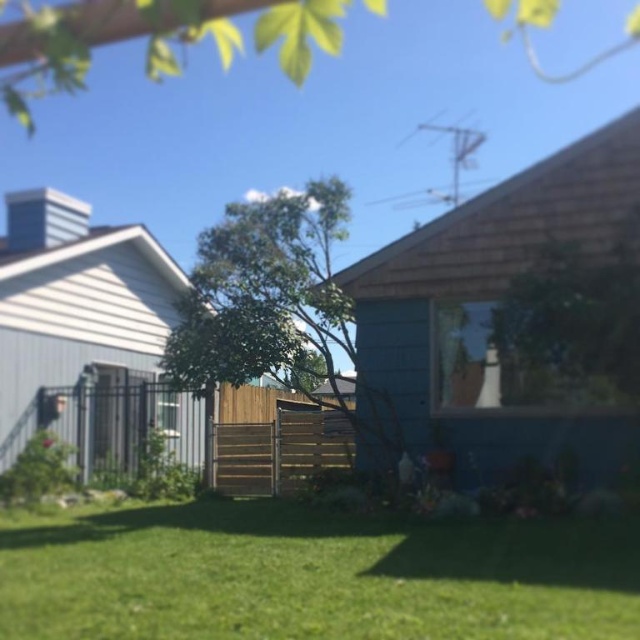
Can you confirm if green leafy tree at center is bigger than brown wooden fence at center?

Correct, green leafy tree at center is larger in size than brown wooden fence at center.

From the picture: Can you confirm if green leafy tree at center is shorter than brown wooden fence at center?

In fact, green leafy tree at center may be taller than brown wooden fence at center.

Describe the element at coordinates (269, 300) in the screenshot. I see `green leafy tree at center` at that location.

Where is `green leafy tree at center`? green leafy tree at center is located at coordinates (269, 300).

Does green grass at lower center have a smaller size compared to brown wooden fence at center?

Yes.

Does green grass at lower center have a lesser width compared to brown wooden fence at center?

Correct, green grass at lower center's width is less than brown wooden fence at center's.

Identify the location of green grass at lower center. (316, 573).

Who is positioned more to the left, green leafy tree at center or green leafy tree at upper center?

green leafy tree at upper center is more to the left.

Does green leafy tree at center have a greater width compared to green leafy tree at upper center?

No.

Identify the location of green leafy tree at center. (269, 300).